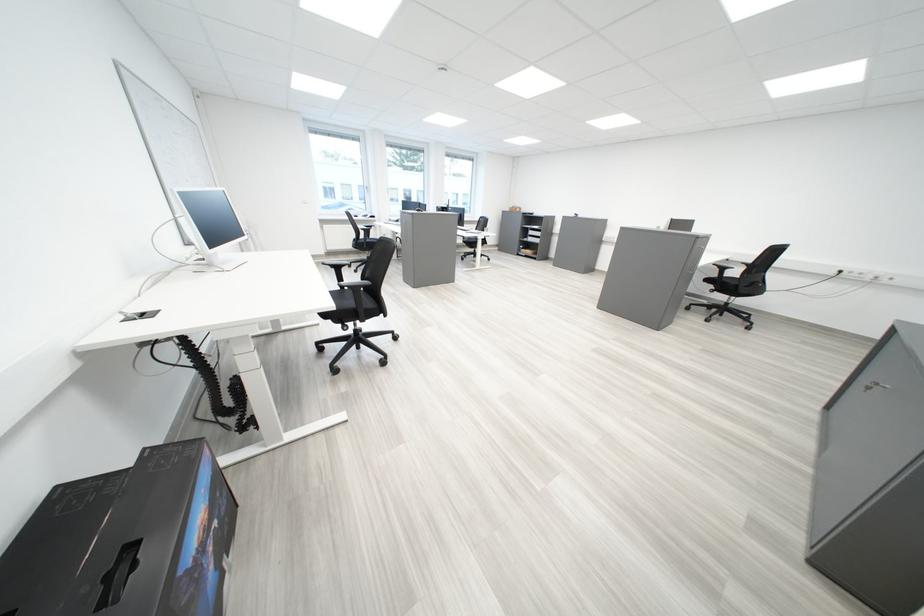
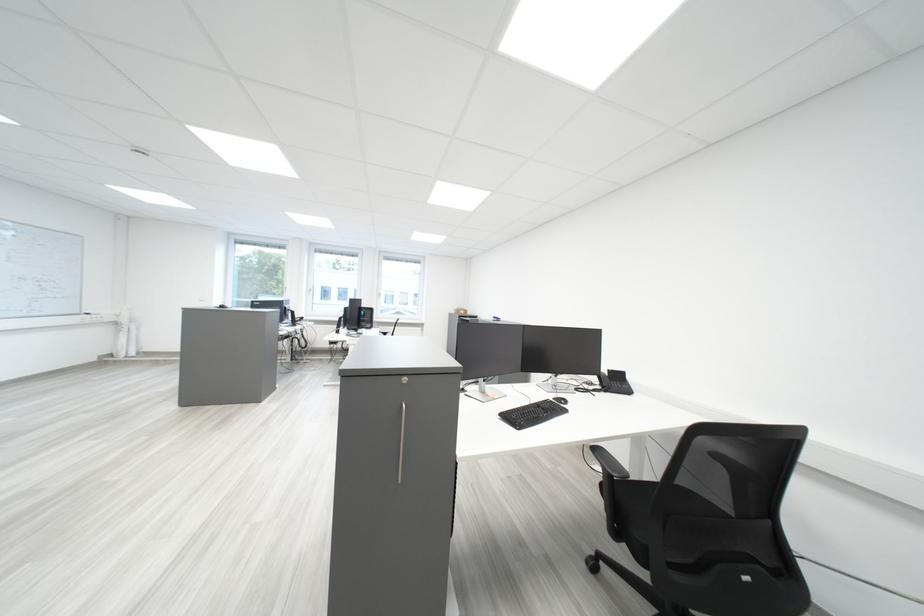
The images are taken continuously from a first-person perspective. In which direction are you moving?

The movement direction of the cameraman is right, forward.